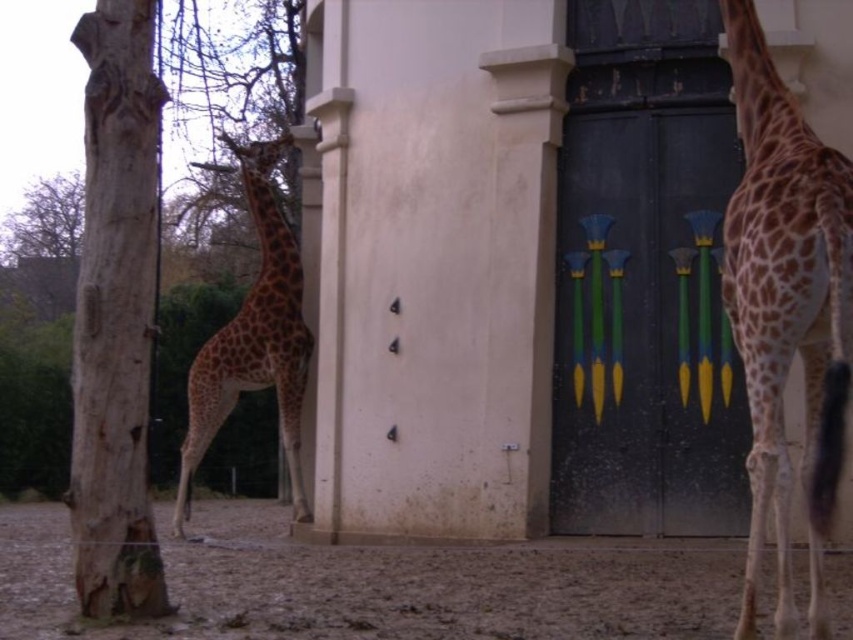
Between point (780, 506) and point (177, 513), which one is positioned in front?

Point (780, 506) is more forward.

Is spotted brown giraffe at right positioned in front of spotted fur giraffe at center?

Yes, it is in front of spotted fur giraffe at center.

Find the location of a particular element. spotted brown giraffe at right is located at coordinates (786, 308).

Find the location of `spotted brown giraffe at right`. spotted brown giraffe at right is located at coordinates (786, 308).

Which is more to the right, smooth wood tree trunk at left or spotted fur giraffe at center?

spotted fur giraffe at center

Based on the photo, is smooth wood tree trunk at left smaller than spotted fur giraffe at center?

No.

Between point (103, 464) and point (270, 310), which one is positioned in front?

Point (103, 464) is in front.

Image resolution: width=853 pixels, height=640 pixels. What are the coordinates of `smooth wood tree trunk at left` in the screenshot? It's located at (115, 317).

Can you confirm if spotted brown giraffe at right is bigger than smooth wood tree trunk at left?

Yes.

You are a GUI agent. You are given a task and a screenshot of the screen. Output one action in this format:
    pyautogui.click(x=<x>, y=<y>)
    Task: Click on the spotted brown giraffe at right
    The height and width of the screenshot is (640, 853).
    Given the screenshot: What is the action you would take?
    pyautogui.click(x=786, y=308)